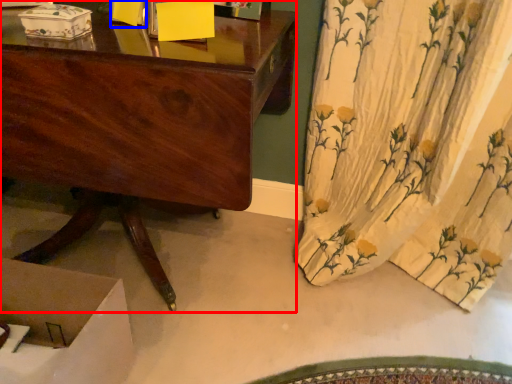
Question: Which object is closer to the camera taking this photo, desk (highlighted by a red box) or box (highlighted by a blue box)?

Choices:
 (A) desk
 (B) box

Answer: (A)